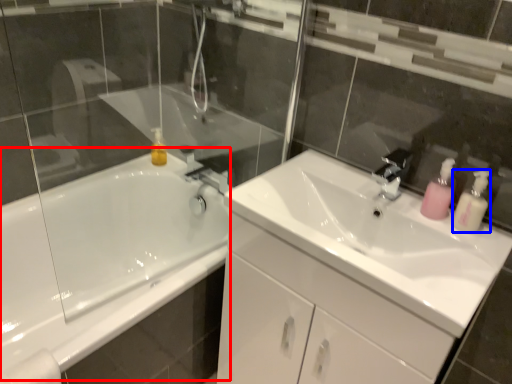
Question: Which object is further to the camera taking this photo, bath (highlighted by a red box) or soap dispenser (highlighted by a blue box)?

Choices:
 (A) bath
 (B) soap dispenser

Answer: (B)